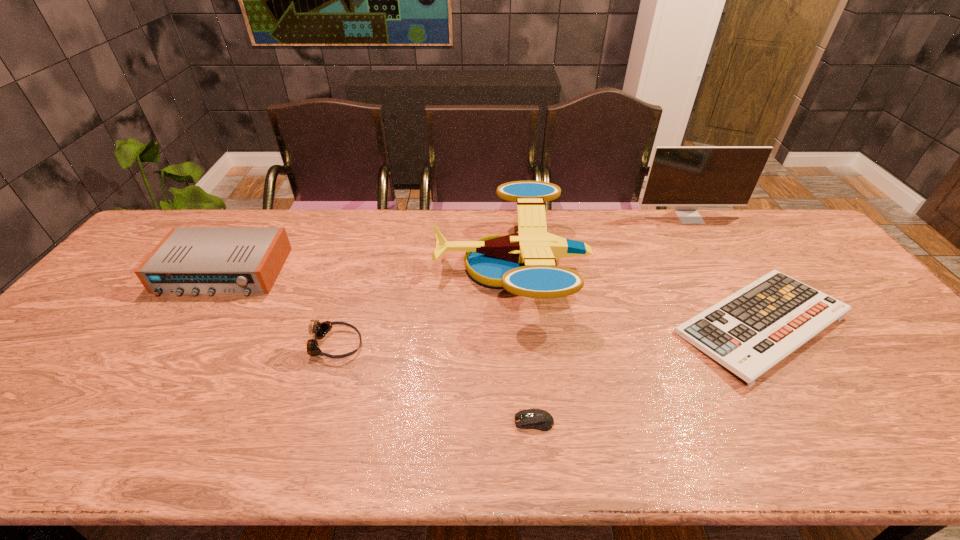
Identify the location of drone that is at the far edge. This screenshot has width=960, height=540. (524, 263).

This screenshot has width=960, height=540. I want to click on radio receiver that is at the far edge, so click(189, 260).

I want to click on object that is at the near edge, so click(x=538, y=419).

Find the location of a particular element. This screenshot has height=540, width=960. object present at the left edge is located at coordinates (189, 260).

The height and width of the screenshot is (540, 960). Find the location of `object located at the right edge`. object located at the right edge is located at coordinates (749, 332).

Locate an element on the screen. This screenshot has height=540, width=960. object that is at the far left corner is located at coordinates (189, 260).

You are a GUI agent. You are given a task and a screenshot of the screen. Output one action in this format:
    pyautogui.click(x=<x>, y=<y>)
    Task: Click on the free space at the far edge of the desktop
    The width and height of the screenshot is (960, 540).
    Given the screenshot: What is the action you would take?
    pos(302,250)

Image resolution: width=960 pixels, height=540 pixels. In order to click on free space at the near edge of the desktop in this screenshot , I will do `click(585, 452)`.

The width and height of the screenshot is (960, 540). I want to click on vacant area at the left edge of the desktop, so click(58, 394).

Locate an element on the screen. The height and width of the screenshot is (540, 960). vacant space at the right edge is located at coordinates (883, 322).